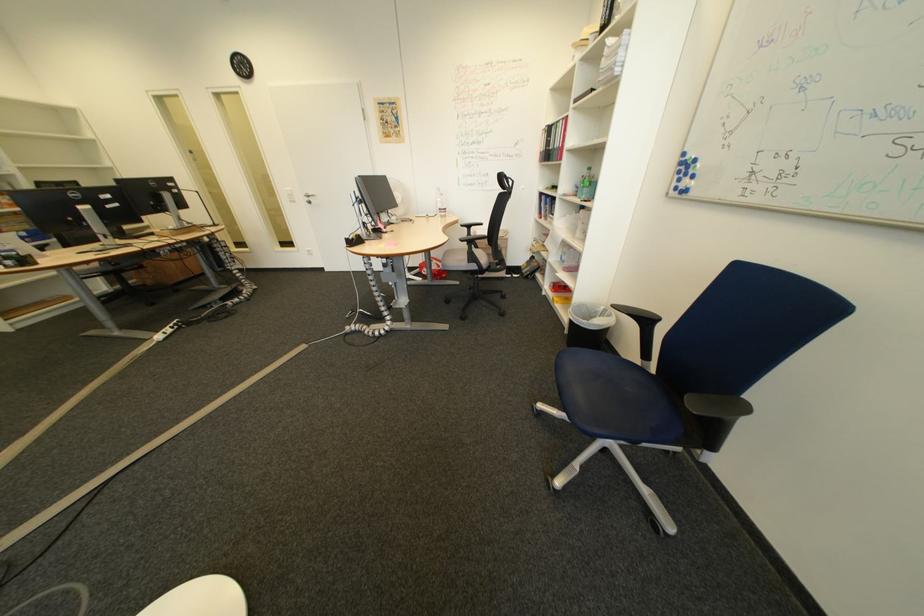
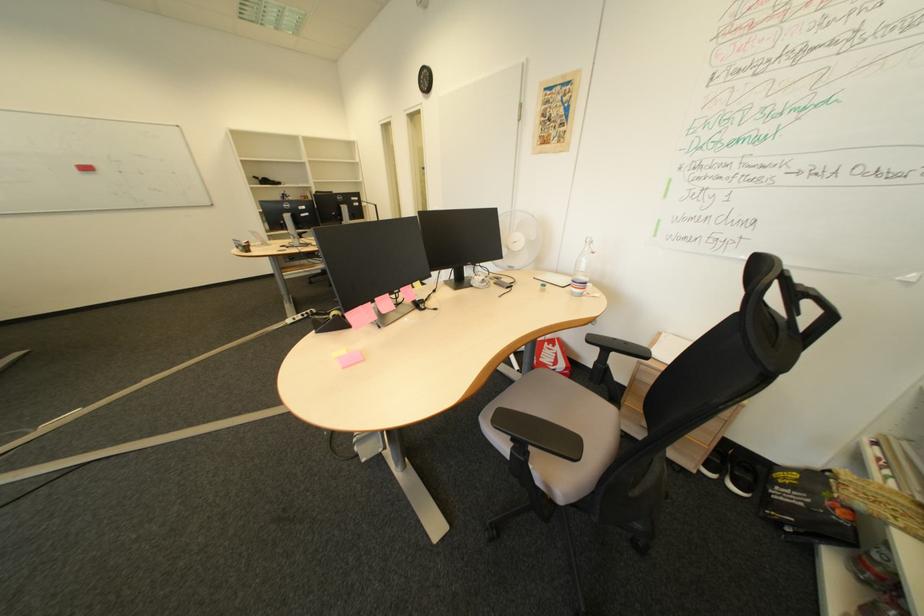
The point at (523, 277) is marked in the first image. Where is the corresponding point in the second image?

(724, 477)